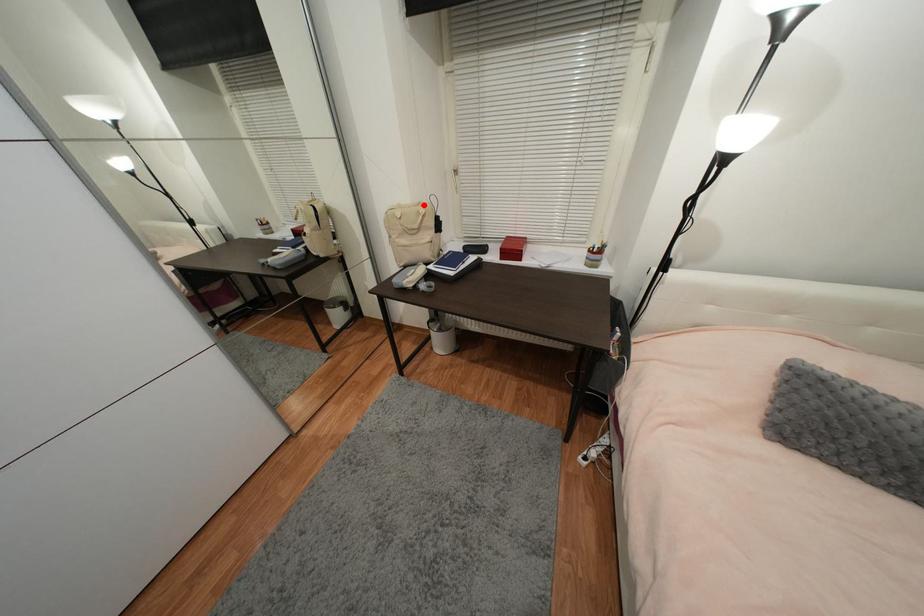
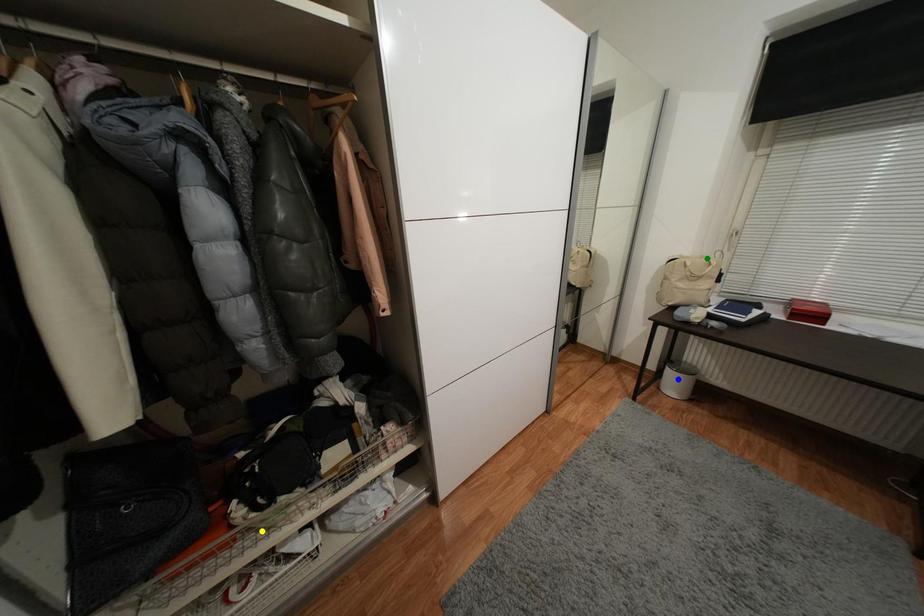
Question: I am providing you with two images of the same scene from different viewpoints. A red point is marked on the first image. You are given multiple points on the second image. Which spot in image 2 lines up with the point in image 1?

Choices:
 (A) yellow point
 (B) green point
 (C) blue point

Answer: (B)